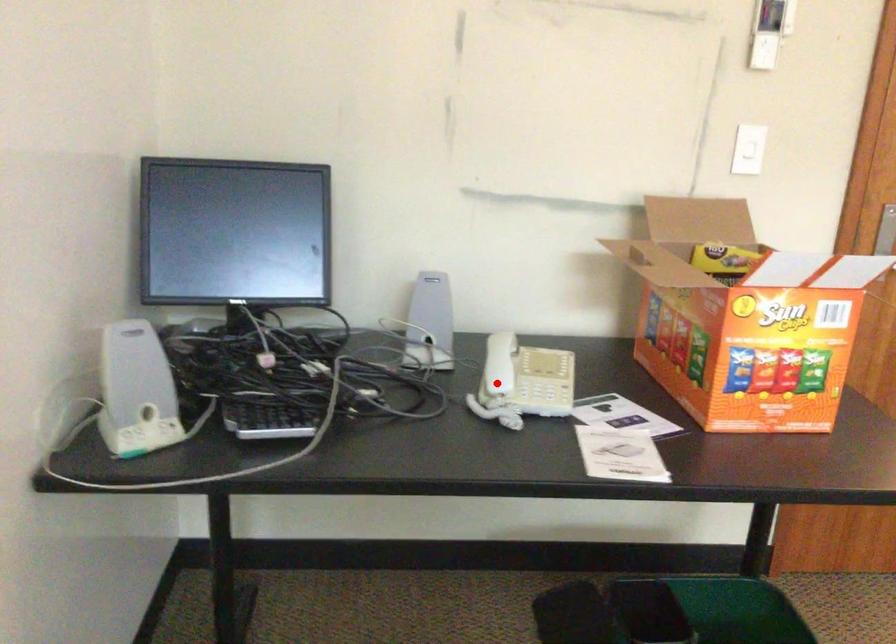
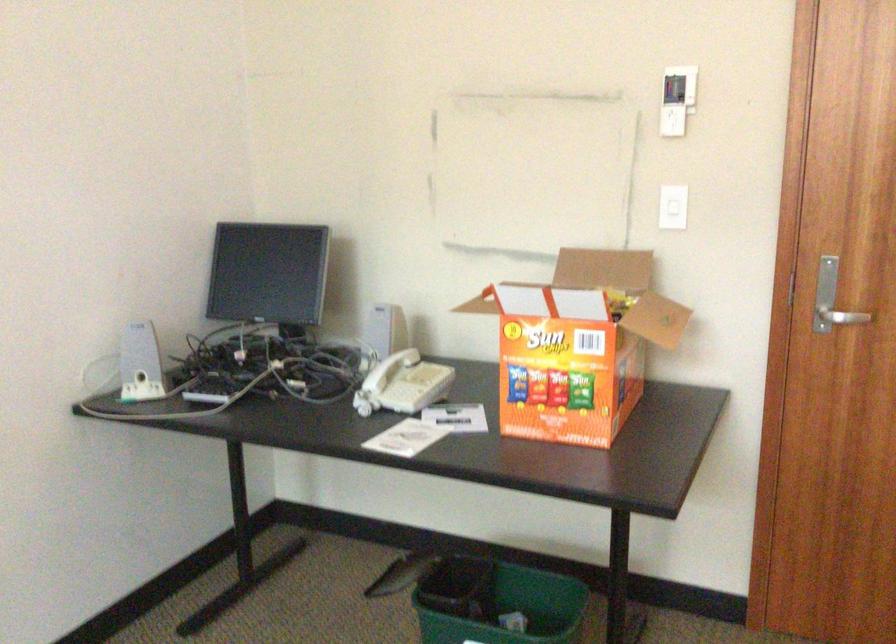
Where in the second image is the point corresponding to the highlighted location from the first image?

(376, 383)